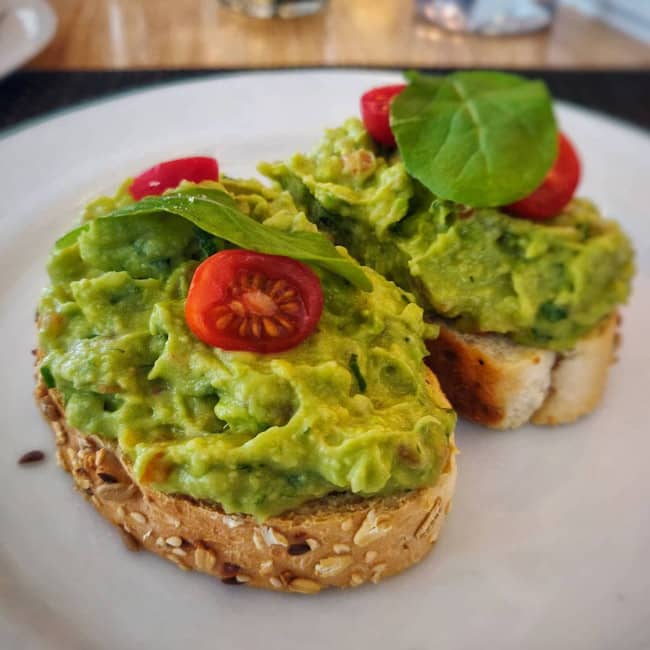
You are a GUI agent. You are given a task and a screenshot of the screen. Output one action in this format:
    pyautogui.click(x=<x>, y=<y>)
    Task: Click on the brown table
    The height and width of the screenshot is (650, 650).
    Given the screenshot: What is the action you would take?
    pyautogui.click(x=107, y=46)